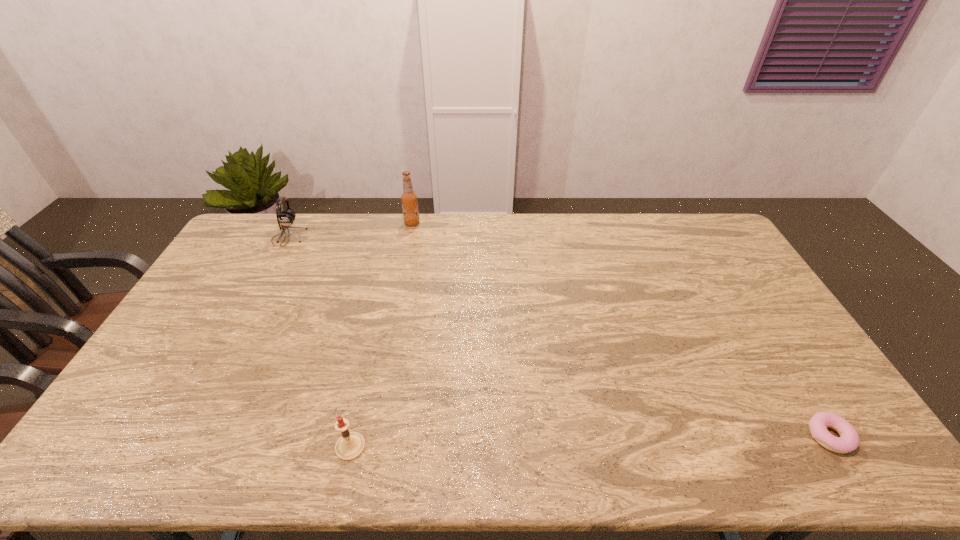
Where is `free space that satisfies the following two spatial constraints: 1. on the front label of the farthest object; 2. on the right side of the doughnut`? The image size is (960, 540). free space that satisfies the following two spatial constraints: 1. on the front label of the farthest object; 2. on the right side of the doughnut is located at coordinates (370, 436).

Image resolution: width=960 pixels, height=540 pixels. What are the coordinates of `vacant space that satisfies the following two spatial constraints: 1. on the front label of the farthest object; 2. on the front side of the second farthest object` in the screenshot? It's located at (409, 238).

Identify the location of free space that satisfies the following two spatial constraints: 1. on the front label of the farthest object; 2. on the front side of the third shortest object. Image resolution: width=960 pixels, height=540 pixels. (409, 238).